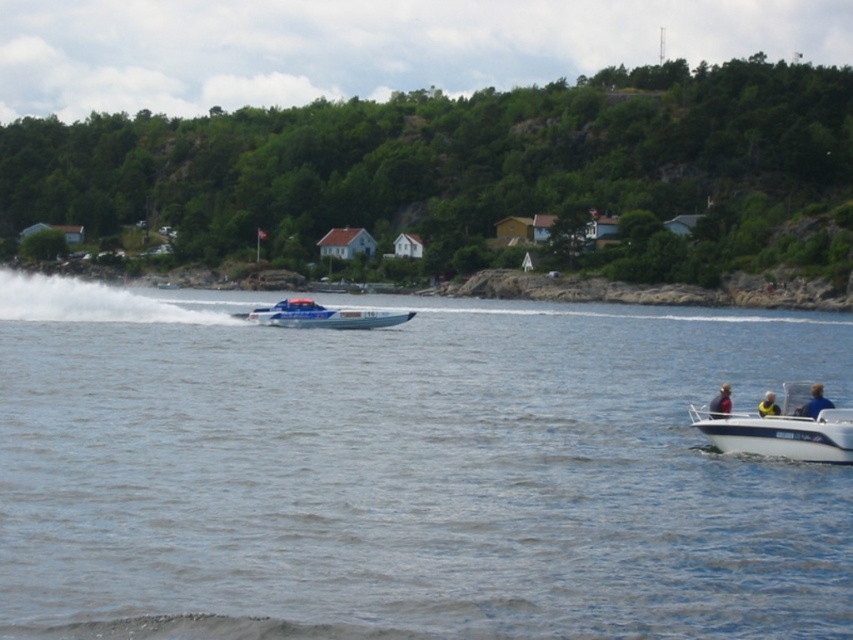
Question: Is blue water at center wider than green leafy hillside at upper center?

Choices:
 (A) yes
 (B) no

Answer: (B)

Question: From the image, what is the correct spatial relationship of blue water at center in relation to blue fabric jacket at lower right?

Choices:
 (A) below
 (B) above

Answer: (B)

Question: Which of these objects is positioned farthest from the blue glossy speedboat at center?

Choices:
 (A) white plastic boat at lower right
 (B) yellow life vest at lower right

Answer: (A)

Question: Which of the following is the farthest from the observer?

Choices:
 (A) smooth skin person at lower right
 (B) green leafy hillside at upper center
 (C) white plastic boat at lower right
 (D) blue fabric jacket at lower right

Answer: (B)

Question: Can you confirm if blue fabric jacket at lower right is bigger than smooth skin person at lower right?

Choices:
 (A) no
 (B) yes

Answer: (B)

Question: Among these objects, which one is farthest from the camera?

Choices:
 (A) smooth skin person at lower right
 (B) green leafy hillside at upper center

Answer: (B)